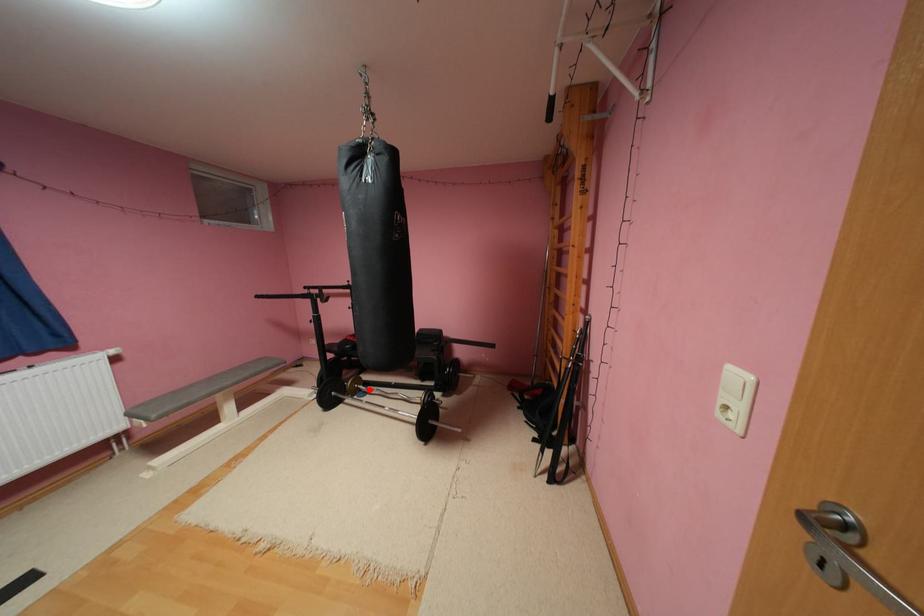
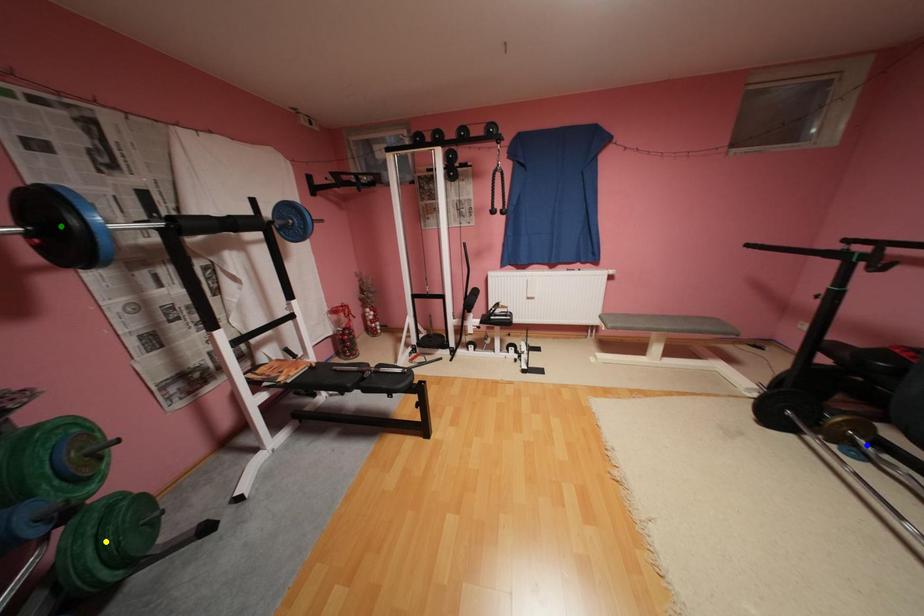
Question: I am providing you with two images of the same scene from different viewpoints. A red point is marked on the first image. You are given multiple points on the second image. Which mark in image 2 goes with the point in image 1?

Choices:
 (A) blue point
 (B) green point
 (C) yellow point

Answer: (A)